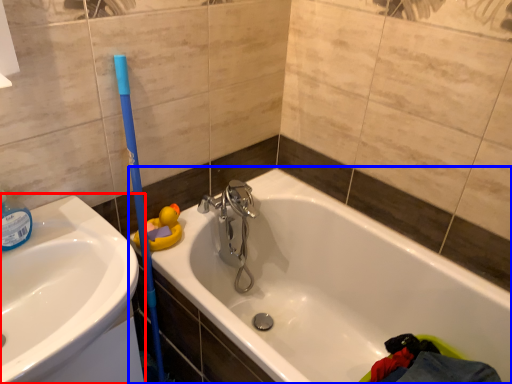
Question: Which point is further to the camera, sink (highlighted by a red box) or bathtub (highlighted by a blue box)?

Choices:
 (A) sink
 (B) bathtub

Answer: (A)